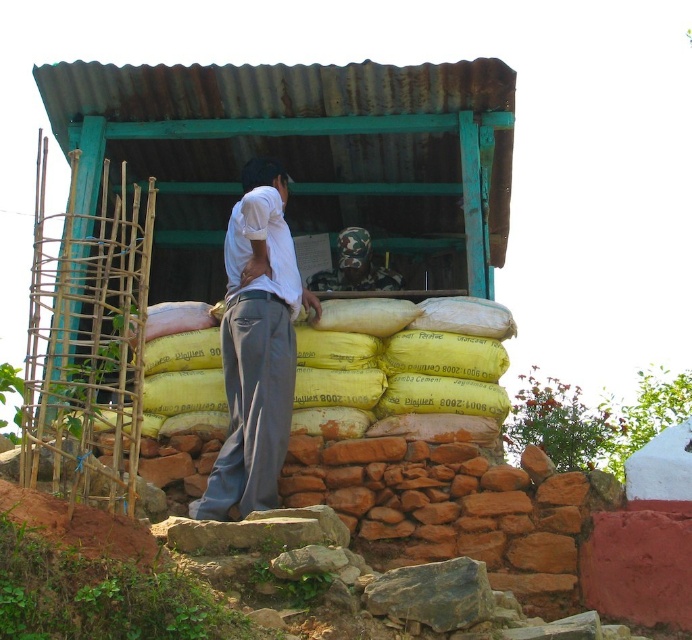
You are a photographer trying to capture a detailed shot of the gray cotton pants at center and the camouflage fabric at center. Which object should you zoom in on to ensure both fit in the frame without cropping?

The gray cotton pants at center has a smaller width compared to the camouflage fabric at center, so you should zoom in on the camouflage fabric at center to ensure both fit in the frame without cropping.